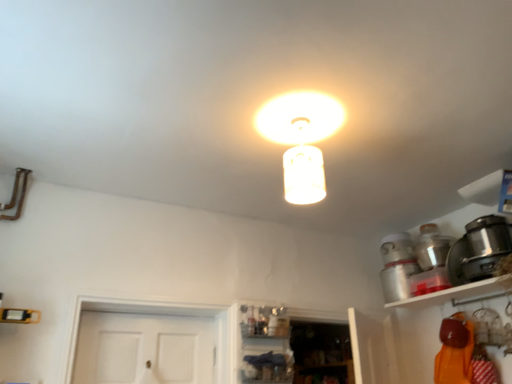
How much space does metallic silver pot at upper right, which is the first appliance from back to front, occupy vertically?

metallic silver pot at upper right, which is the first appliance from back to front, is 20.74 centimeters tall.

At what (x,y) coordinates should I click in order to perform the action: click on white glossy shelf at upper right. Please return your answer as a coordinate pair (x, y). Image resolution: width=512 pixels, height=384 pixels. Looking at the image, I should click on (449, 294).

Is the position of matte glass lampshade at center more distant than that of metallic silver pot at upper right, which is the first appliance from back to front?

No, matte glass lampshade at center is closer to the viewer.

Would you consider matte glass lampshade at center to be distant from metallic silver pot at upper right, the second appliance in the front-to-back sequence?

Yes, matte glass lampshade at center and metallic silver pot at upper right, the second appliance in the front-to-back sequence, are located far from each other.

Which point is more distant from viewer, (x=324, y=124) or (x=420, y=230)?

The point (x=420, y=230) is farther from the camera.

Is matte glass lampshade at center to the left of metallic silver pot at upper right, which is the first appliance from back to front, from the viewer's perspective?

Yes, matte glass lampshade at center is to the left of metallic silver pot at upper right, which is the first appliance from back to front.

Which is behind, point (477, 285) or point (263, 129)?

The point (477, 285) is behind.

From the picture: Is white glossy shelf at upper right turned away from matte glass lampshade at center?

No, matte glass lampshade at center is not at the back of white glossy shelf at upper right.

Which object is positioned more to the right, white glossy shelf at upper right or matte glass lampshade at center?

white glossy shelf at upper right.

Between white glossy shelf at upper right and matte glass lampshade at center, which one has smaller width?

matte glass lampshade at center is thinner.

Identify the location of appliance below the metallic silver pot at upper right, which is the first appliance from back to front (from a real-world perspective). (479, 249).

Would you consider satin black pot at right, marked as the 2th appliance in a back-to-front arrangement, to be distant from metallic silver pot at upper right, the second appliance in the front-to-back sequence?

Actually, satin black pot at right, marked as the 2th appliance in a back-to-front arrangement, and metallic silver pot at upper right, the second appliance in the front-to-back sequence, are a little close together.

Between satin black pot at right, marked as the 2th appliance in a back-to-front arrangement, and metallic silver pot at upper right, the second appliance in the front-to-back sequence, which one has larger size?

A: With larger size is metallic silver pot at upper right, the second appliance in the front-to-back sequence.

Is satin black pot at right, which is counted as the 1th appliance, starting from the front, shorter than metallic silver pot at upper right, which is the first appliance from back to front?

No, satin black pot at right, which is counted as the 1th appliance, starting from the front, is not shorter than metallic silver pot at upper right, which is the first appliance from back to front.

Is matte glass lampshade at center aimed at satin black pot at right, marked as the 2th appliance in a back-to-front arrangement?

No.

Is point (322, 107) positioned behind point (464, 260)?

That is False.

Measure the distance from matte glass lampshade at center to satin black pot at right, marked as the 2th appliance in a back-to-front arrangement.

They are 4.02 feet apart.

Looking at this image, which of these two, matte glass lampshade at center or satin black pot at right, which is counted as the 1th appliance, starting from the front, is thinner?

Thinner between the two is matte glass lampshade at center.

Is metallic silver pot at upper right, the second appliance in the front-to-back sequence, closer to the viewer compared to satin black pot at right, marked as the 2th appliance in a back-to-front arrangement?

No.

In the image, there is a metallic silver pot at upper right, which is the first appliance from back to front. At what (x,y) coordinates should I click in order to perform the action: click on appliance above it (from the image's perspective). Please return your answer as a coordinate pair (x, y). Looking at the image, I should click on (479, 249).

Measure the distance from metallic silver pot at upper right, the second appliance in the front-to-back sequence, to satin black pot at right, which is counted as the 1th appliance, starting from the front.

They are 8.69 inches apart.

Does metallic silver pot at upper right, which is the first appliance from back to front, appear on the right side of satin black pot at right, marked as the 2th appliance in a back-to-front arrangement?

In fact, metallic silver pot at upper right, which is the first appliance from back to front, is to the left of satin black pot at right, marked as the 2th appliance in a back-to-front arrangement.

Is satin black pot at right, marked as the 2th appliance in a back-to-front arrangement, in front of or behind matte glass lampshade at center in the image?

satin black pot at right, marked as the 2th appliance in a back-to-front arrangement, is positioned farther from the viewer than matte glass lampshade at center.

Between satin black pot at right, which is counted as the 1th appliance, starting from the front, and matte glass lampshade at center, which one has more height?

matte glass lampshade at center.

Is satin black pot at right, which is counted as the 1th appliance, starting from the front, looking in the opposite direction of matte glass lampshade at center?

No, matte glass lampshade at center is not at the back of satin black pot at right, which is counted as the 1th appliance, starting from the front.

Based on the photo, can you confirm if satin black pot at right, which is counted as the 1th appliance, starting from the front, is smaller than matte glass lampshade at center?

Yes, satin black pot at right, which is counted as the 1th appliance, starting from the front, is smaller than matte glass lampshade at center.

From the picture: Considering the relative sizes of matte glass lampshade at center and white glossy shelf at upper right in the image provided, is matte glass lampshade at center bigger than white glossy shelf at upper right?

No.

In the image, there is a matte glass lampshade at center. Find the location of `shelf below it (from the image's perspective)`. shelf below it (from the image's perspective) is located at coordinates (449, 294).

Looking at this image, considering the relative positions of matte glass lampshade at center and white glossy shelf at upper right in the image provided, is matte glass lampshade at center to the left or to the right of white glossy shelf at upper right?

Based on their positions, matte glass lampshade at center is located to the left of white glossy shelf at upper right.

From the matte glass lampshade at center, count 2nd appliances backward and point to it. Please provide its 2D coordinates.

[(432, 247)]

Where is `lamp that is above the white glossy shelf at upper right (from the image's perspective)`? lamp that is above the white glossy shelf at upper right (from the image's perspective) is located at coordinates (301, 140).

Looking at the image, which one is located further to satin black pot at right, marked as the 2th appliance in a back-to-front arrangement, matte glass lampshade at center or metallic silver pot at upper right, the second appliance in the front-to-back sequence?

matte glass lampshade at center is positioned further to the anchor satin black pot at right, marked as the 2th appliance in a back-to-front arrangement.

Which object lies further to the anchor point matte glass lampshade at center, white glossy shelf at upper right or metallic silver pot at upper right, which is the first appliance from back to front?

metallic silver pot at upper right, which is the first appliance from back to front, is positioned further to the anchor matte glass lampshade at center.

Which object lies nearer to the anchor point metallic silver pot at upper right, which is the first appliance from back to front, matte glass lampshade at center or white glossy shelf at upper right?

white glossy shelf at upper right is closer to metallic silver pot at upper right, which is the first appliance from back to front.

Estimate the real-world distances between objects in this image. Which object is further from metallic silver pot at upper right, the second appliance in the front-to-back sequence, white glossy shelf at upper right or satin black pot at right, marked as the 2th appliance in a back-to-front arrangement?

white glossy shelf at upper right is positioned further to the anchor metallic silver pot at upper right, the second appliance in the front-to-back sequence.

In the scene shown: Which object lies further to the anchor point satin black pot at right, marked as the 2th appliance in a back-to-front arrangement, metallic silver pot at upper right, which is the first appliance from back to front, or white glossy shelf at upper right?

metallic silver pot at upper right, which is the first appliance from back to front, is positioned further to the anchor satin black pot at right, marked as the 2th appliance in a back-to-front arrangement.

Looking at the image, which one is located closer to matte glass lampshade at center, satin black pot at right, marked as the 2th appliance in a back-to-front arrangement, or metallic silver pot at upper right, the second appliance in the front-to-back sequence?

The object closer to matte glass lampshade at center is satin black pot at right, marked as the 2th appliance in a back-to-front arrangement.

From the picture: Looking at the image, which one is located further to white glossy shelf at upper right, matte glass lampshade at center or satin black pot at right, which is counted as the 1th appliance, starting from the front?

matte glass lampshade at center is positioned further to the anchor white glossy shelf at upper right.

Consider the image. From the image, which object appears to be farther from metallic silver pot at upper right, the second appliance in the front-to-back sequence, matte glass lampshade at center or satin black pot at right, which is counted as the 1th appliance, starting from the front?

Based on the image, matte glass lampshade at center appears to be further to metallic silver pot at upper right, the second appliance in the front-to-back sequence.

This screenshot has width=512, height=384. In order to click on shelf between matte glass lampshade at center and satin black pot at right, which is counted as the 1th appliance, starting from the front in this screenshot , I will do `click(449, 294)`.

This screenshot has width=512, height=384. Find the location of `appliance between matte glass lampshade at center and satin black pot at right, which is counted as the 1th appliance, starting from the front, in the horizontal direction`. appliance between matte glass lampshade at center and satin black pot at right, which is counted as the 1th appliance, starting from the front, in the horizontal direction is located at coordinates (432, 247).

I want to click on appliance located between white glossy shelf at upper right and metallic silver pot at upper right, which is the first appliance from back to front, in the depth direction, so click(x=479, y=249).

Find the location of a particular element. appliance between matte glass lampshade at center and white glossy shelf at upper right from left to right is located at coordinates pyautogui.click(x=432, y=247).